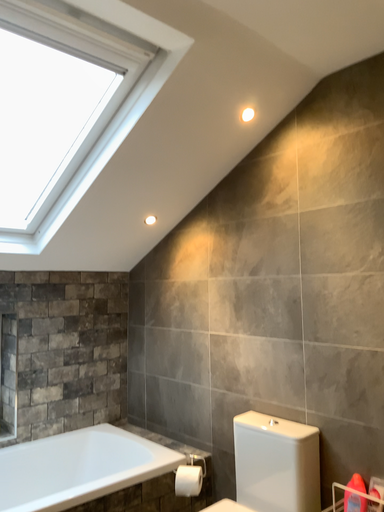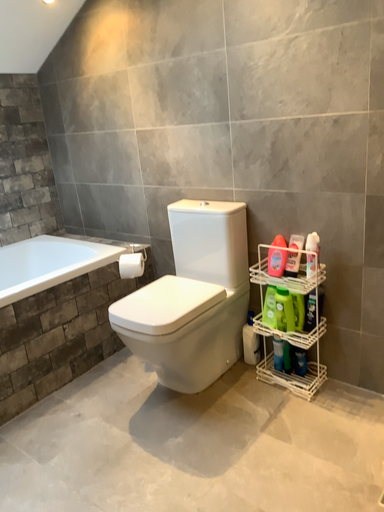
Question: How did the camera likely rotate when shooting the video?

Choices:
 (A) rotated upward
 (B) rotated downward

Answer: (B)